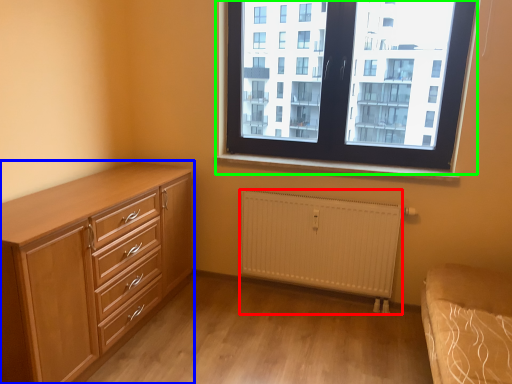
Question: Which object is positioned farthest from radiator (highlighted by a red box)? Select from chest of drawers (highlighted by a blue box) and window (highlighted by a green box).

Choices:
 (A) chest of drawers
 (B) window

Answer: (A)